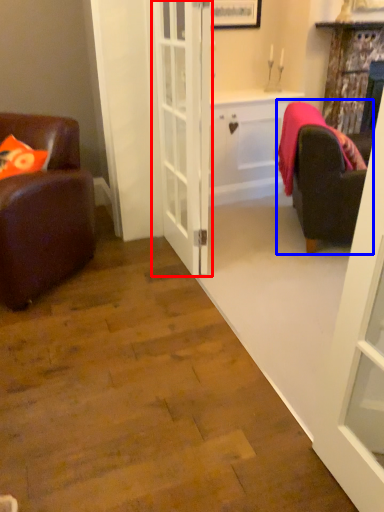
Question: Which object appears closest to the camera in this image, door (highlighted by a red box) or studio couch (highlighted by a blue box)?

Choices:
 (A) door
 (B) studio couch

Answer: (A)